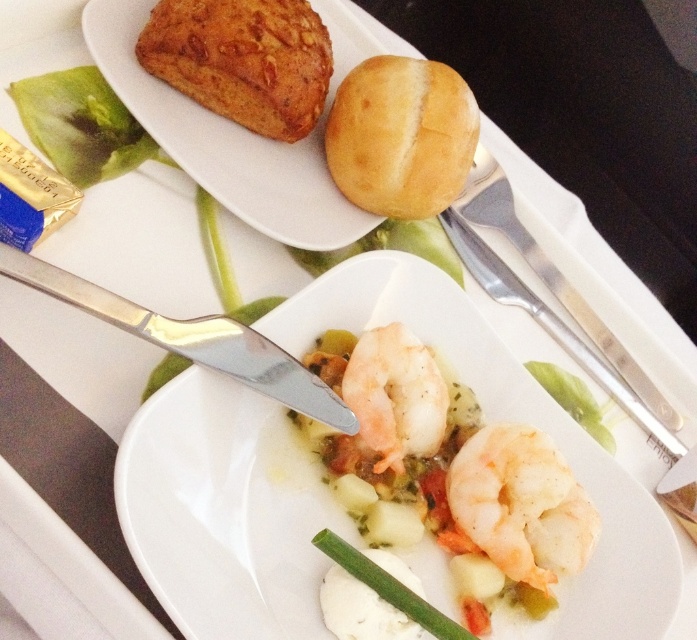
You are a food critic standing 5 feet away from the plate. Is the point at coordinate point [445,92] on the plate closer to you than your current position?

The distance of point [445,92] from camera is 3.64 feet, which is closer than your current position of 5 feet away. So yes, the point is closer to you.

You are a food critic evaluating this meal. You notice the golden matte bun at upper center and the pale pink flesh at center. Based on their positions, which one is located higher up on the plate?

The golden matte bun at upper center is located higher up on the plate than the pale pink flesh at center.

Consider the image. You are a food critic evaluating the height of items on the plate. Which item is taller between the golden matte bun at upper center and the green leafy vegetable at upper left?

The golden matte bun at upper center is much taller than the green leafy vegetable at upper left.